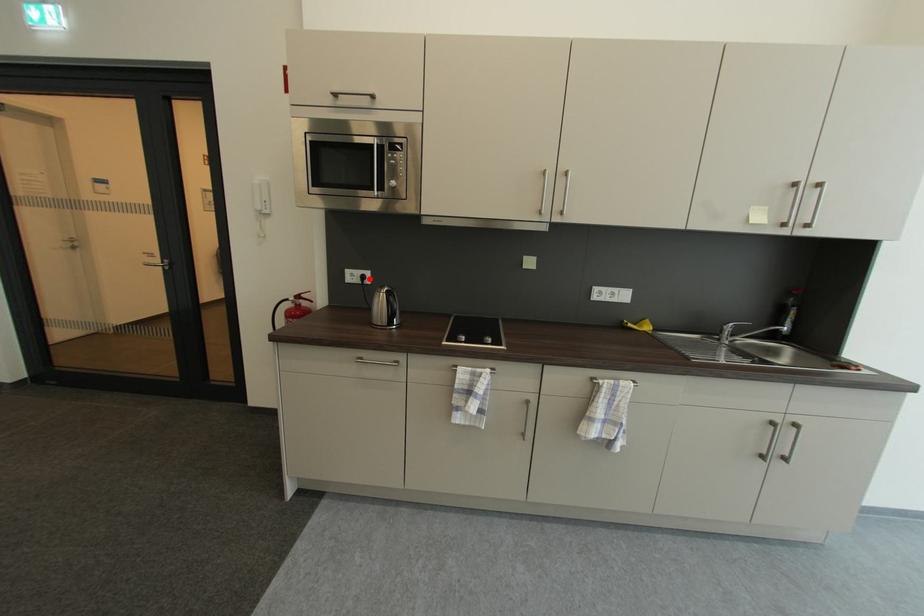
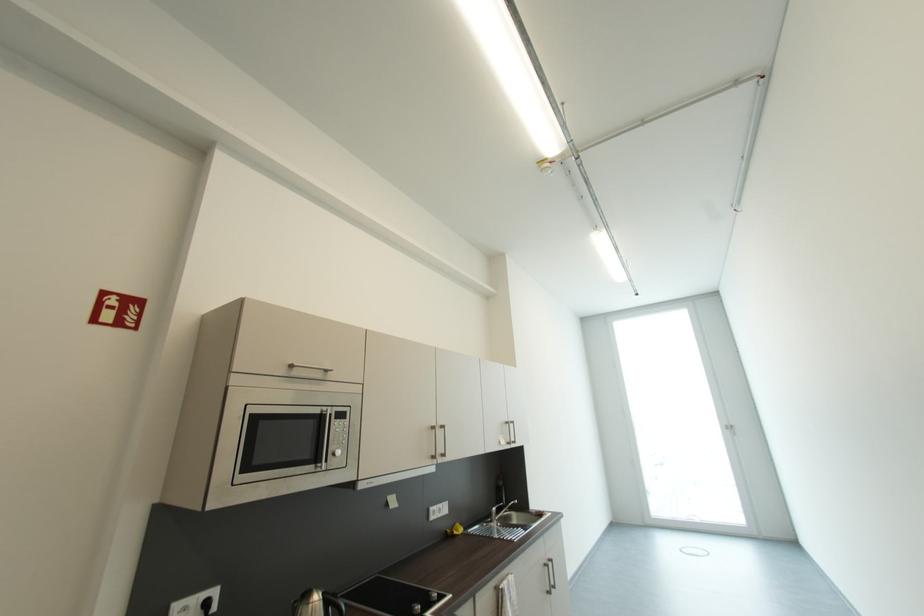
Where in the second image is the point corresponding to the highlighted location from the first image?

(213, 605)